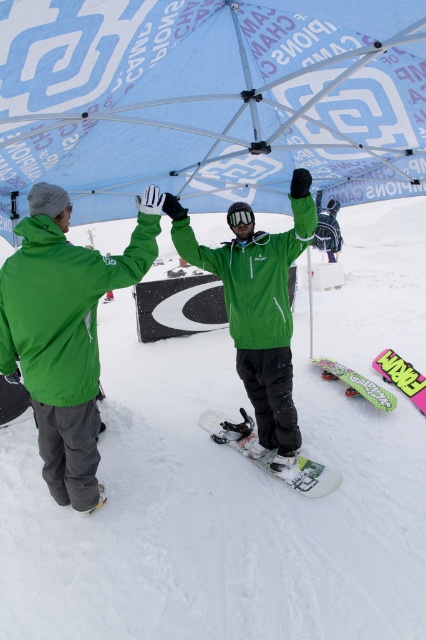
Between green matte jacket at center and pink matte snowboard at lower right, which one is positioned lower?

pink matte snowboard at lower right

Can you confirm if green matte jacket at center is thinner than pink matte snowboard at lower right?

In fact, green matte jacket at center might be wider than pink matte snowboard at lower right.

Describe the element at coordinates (258, 307) in the screenshot. The height and width of the screenshot is (640, 426). I see `green matte jacket at center` at that location.

Identify the location of green matte jacket at center. This screenshot has width=426, height=640. (258, 307).

Can you confirm if white matte snowboard at center is smaller than blue printed canopy at upper center?

No.

Based on the photo, between white matte snowboard at center and blue printed canopy at upper center, which one has less height?

With less height is blue printed canopy at upper center.

Which is behind, point (241, 621) or point (198, 141)?

Point (198, 141)

At what (x,y) coordinates should I click in order to perform the action: click on white matte snowboard at center. Please return your answer as a coordinate pair (x, y). The height and width of the screenshot is (640, 426). Looking at the image, I should click on (238, 481).

Is pink matte snowboard at lower right wider than neon green plastic snowboard at lower right?

Incorrect, pink matte snowboard at lower right's width does not surpass neon green plastic snowboard at lower right's.

Who is higher up, pink matte snowboard at lower right or neon green plastic snowboard at lower right?

Positioned higher is pink matte snowboard at lower right.

Which is in front, point (411, 394) or point (354, 381)?

Point (411, 394) is more forward.

Locate an element on the screen. The width and height of the screenshot is (426, 640). pink matte snowboard at lower right is located at coordinates (402, 376).